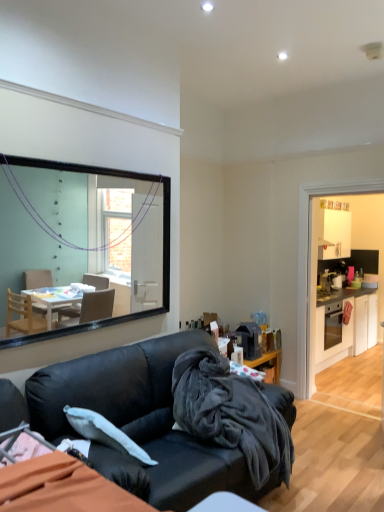
What do you see at coordinates (341, 290) in the screenshot? The height and width of the screenshot is (512, 384). I see `white glossy dresser at right` at bounding box center [341, 290].

Measure the distance between white glossy dresser at right and camera.

white glossy dresser at right and camera are 5.23 meters apart from each other.

What do you see at coordinates (136, 417) in the screenshot?
I see `black leather couch at center` at bounding box center [136, 417].

Identify the location of white glossy cabinets at right. (345, 327).

Do you think black leather couch at center is within white glossy dresser at right, or outside of it?

black leather couch at center is located beyond the bounds of white glossy dresser at right.

From the image's perspective, who appears lower, black leather couch at center or white glossy dresser at right?

black leather couch at center appears lower in the image.

From the picture: Which is closer, (163, 493) or (313, 340)?

The point (163, 493) is in front.

Can you tell me how much black leather couch at center and velvety dark gray blanket at center differ in facing direction?

0.000641 degrees.

Is black leather couch at center oriented towards velvety dark gray blanket at center?

Yes, black leather couch at center is aimed at velvety dark gray blanket at center.

Which of these two, black leather couch at center or velvety dark gray blanket at center, stands taller?

black leather couch at center.

Is point (274, 398) closer to viewer compared to point (205, 400)?

No, (274, 398) is further to viewer.

How different are the orientations of white glossy cabinets at right and black leather couch at center in degrees?

The angular difference between white glossy cabinets at right and black leather couch at center is 0.000937 degrees.

From the image's perspective, is white glossy cabinets at right above or below black leather couch at center?

From the image's perspective, white glossy cabinets at right appears above black leather couch at center.

Which of these two, white glossy cabinets at right or black leather couch at center, is wider?

With larger width is black leather couch at center.

Is white glossy dresser at right touching white glossy cabinets at right?

Yes, white glossy dresser at right is next to white glossy cabinets at right.

Where is `cabinetry below the white glossy dresser at right (from the image's perspective)`? cabinetry below the white glossy dresser at right (from the image's perspective) is located at coordinates (345, 327).

Between white glossy dresser at right and white glossy cabinets at right, which one has larger size?

With larger size is white glossy cabinets at right.

How much distance is there between white glossy cabinets at right and velvety dark gray blanket at center?

A distance of 3.10 meters exists between white glossy cabinets at right and velvety dark gray blanket at center.

From the image's perspective, would you say white glossy cabinets at right is positioned over velvety dark gray blanket at center?

Yes.

Is white glossy cabinets at right positioned with its back to velvety dark gray blanket at center?

white glossy cabinets at right is not turned away from velvety dark gray blanket at center.

In terms of size, does white glossy cabinets at right appear bigger or smaller than velvety dark gray blanket at center?

white glossy cabinets at right is bigger than velvety dark gray blanket at center.

Does velvety dark gray blanket at center come behind black leather couch at center?

Yes, velvety dark gray blanket at center is further from the viewer.

From the picture: From the image's perspective, is velvety dark gray blanket at center located above or below black leather couch at center?

From the image's perspective, velvety dark gray blanket at center appears above black leather couch at center.

Is velvety dark gray blanket at center turned away from black leather couch at center?

Yes, velvety dark gray blanket at center is positioned with its back facing black leather couch at center.

You are a GUI agent. You are given a task and a screenshot of the screen. Output one action in this format:
    pyautogui.click(x=<x>, y=<y>)
    Task: Click on the blanket on the right of black leather couch at center
    
    Given the screenshot: What is the action you would take?
    pyautogui.click(x=231, y=413)

From the picture: Is black leather couch at center beside white glossy cabinets at right?

There is a gap between black leather couch at center and white glossy cabinets at right.

Does black leather couch at center come behind white glossy cabinets at right?

No.

Between black leather couch at center and white glossy cabinets at right, which one appears on the left side from the viewer's perspective?

black leather couch at center is more to the left.

Locate an element on the screen. This screenshot has width=384, height=512. studio couch that appears in front of the white glossy dresser at right is located at coordinates (136, 417).

Where is `studio couch that appears below the velvety dark gray blanket at center (from the image's perspective)`? studio couch that appears below the velvety dark gray blanket at center (from the image's perspective) is located at coordinates (136, 417).

Based on their spatial positions, is black leather couch at center or white glossy cabinets at right further from velvety dark gray blanket at center?

Based on the image, white glossy cabinets at right appears to be further to velvety dark gray blanket at center.

Considering their positions, is velvety dark gray blanket at center positioned further to white glossy cabinets at right than white glossy dresser at right?

Based on the image, velvety dark gray blanket at center appears to be further to white glossy cabinets at right.

From the image, which object appears to be farther from white glossy cabinets at right, white glossy dresser at right or velvety dark gray blanket at center?

Among the two, velvety dark gray blanket at center is located further to white glossy cabinets at right.

When comparing their distances from white glossy dresser at right, does velvety dark gray blanket at center or white glossy cabinets at right seem further?

velvety dark gray blanket at center lies further to white glossy dresser at right than the other object.

From the image, which object appears to be nearer to velvety dark gray blanket at center, white glossy dresser at right or black leather couch at center?

black leather couch at center is positioned closer to the anchor velvety dark gray blanket at center.

Based on their spatial positions, is black leather couch at center or velvety dark gray blanket at center closer to white glossy cabinets at right?

The object closer to white glossy cabinets at right is velvety dark gray blanket at center.

From the image, which object appears to be nearer to black leather couch at center, white glossy dresser at right or white glossy cabinets at right?

white glossy cabinets at right.

Which object lies nearer to the anchor point white glossy cabinets at right, velvety dark gray blanket at center or black leather couch at center?

Among the two, velvety dark gray blanket at center is located nearer to white glossy cabinets at right.

You are a GUI agent. You are given a task and a screenshot of the screen. Output one action in this format:
    pyautogui.click(x=<x>, y=<y>)
    Task: Click on the dresser between velvety dark gray blanket at center and white glossy cabinets at right from front to back
    The image size is (384, 512).
    Given the screenshot: What is the action you would take?
    pyautogui.click(x=341, y=290)

What are the coordinates of `blanket located between black leather couch at center and white glossy dresser at right in the depth direction` in the screenshot? It's located at (231, 413).

Identify the location of blanket between black leather couch at center and white glossy cabinets at right from front to back. (231, 413).

Identify the location of dresser located between black leather couch at center and white glossy cabinets at right in the depth direction. (341, 290).